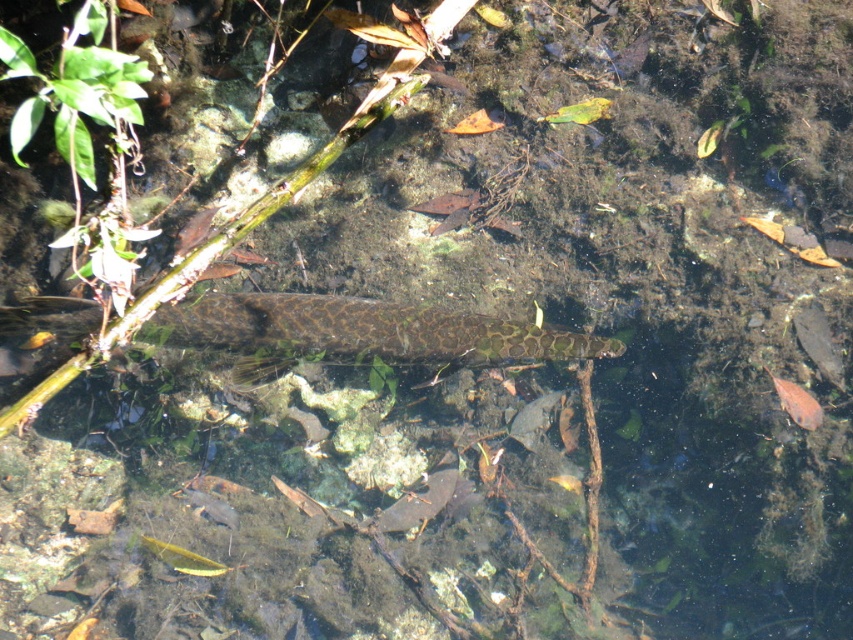
Is green textured snake at center thinner than translucent orange fish at lower right?

In fact, green textured snake at center might be wider than translucent orange fish at lower right.

In the scene shown: Does green textured snake at center appear under translucent orange fish at lower right?

No, green textured snake at center is not below translucent orange fish at lower right.

Find the location of a particular element. The width and height of the screenshot is (853, 640). green textured snake at center is located at coordinates (357, 332).

Image resolution: width=853 pixels, height=640 pixels. In order to click on green textured snake at center in this screenshot , I will do `click(357, 332)`.